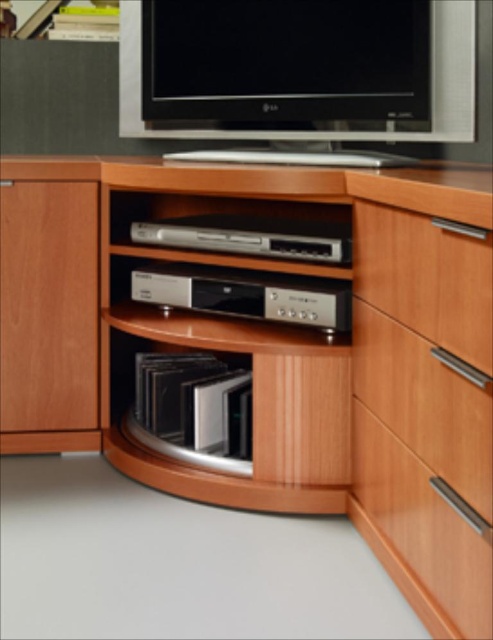
Question: Is wooden drawer at right above black glossy cd case at center?

Choices:
 (A) yes
 (B) no

Answer: (A)

Question: Which of the following is the farthest from the observer?

Choices:
 (A) (194, 355)
 (B) (190, 435)
 (C) (343, 262)
 (D) (400, 252)

Answer: (A)

Question: Among these points, which one is nearest to the camera?

Choices:
 (A) (271, 243)
 (B) (367, 280)

Answer: (B)

Question: Which of the following is the closest to the observer?

Choices:
 (A) (140, 236)
 (B) (248, 413)
 (C) (413, 449)

Answer: (C)

Question: Where is satin silver dvd player at center located in relation to satin black vinyl records at lower center in the image?

Choices:
 (A) left
 (B) right

Answer: (B)

Question: Can you confirm if silver metallic dvd player at center is bigger than satin black vinyl records at lower center?

Choices:
 (A) yes
 (B) no

Answer: (A)